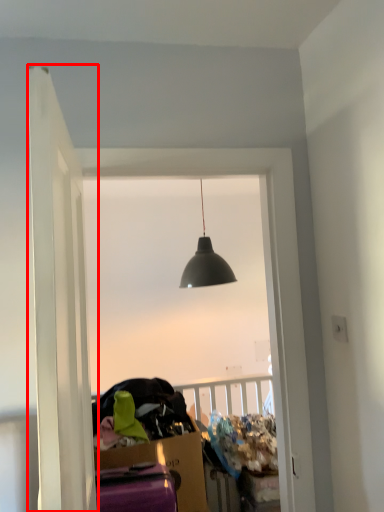
Question: Considering the relative positions of door (annotated by the red box) and window in the image provided, where is door (annotated by the red box) located with respect to the staircase?

Choices:
 (A) left
 (B) right

Answer: (A)